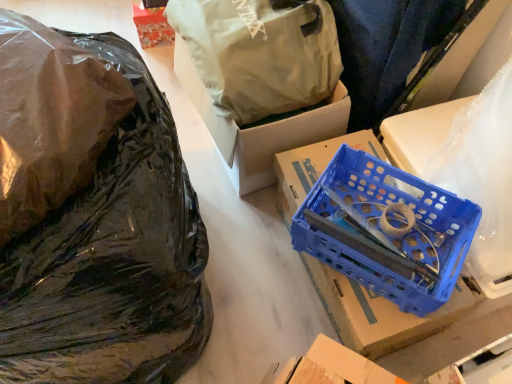
Question: From a real-world perspective, is transparent plastic bag at left, placed as the second plastic bag when sorted from top to bottom, positioned under matte white plastic bag at upper center, which ranks as the 1th plastic bag in top-to-bottom order, based on gravity?

Choices:
 (A) no
 (B) yes

Answer: (A)

Question: Does transparent plastic bag at left, which appears as the second plastic bag when ordered from the bottom, have a lesser width compared to matte white plastic bag at upper center, which ranks as the 1th plastic bag in top-to-bottom order?

Choices:
 (A) no
 (B) yes

Answer: (A)

Question: Is transparent plastic bag at left, placed as the second plastic bag when sorted from top to bottom, to the right of matte white plastic bag at upper center, which is the 3th plastic bag in bottom-to-top order, from the viewer's perspective?

Choices:
 (A) yes
 (B) no

Answer: (B)

Question: From a real-world perspective, is transparent plastic bag at left, placed as the second plastic bag when sorted from top to bottom, on matte white plastic bag at upper center, which is the 3th plastic bag in bottom-to-top order?

Choices:
 (A) yes
 (B) no

Answer: (A)

Question: Considering the relative positions of transparent plastic bag at left, placed as the second plastic bag when sorted from top to bottom, and matte white plastic bag at upper center, which is the 3th plastic bag in bottom-to-top order, in the image provided, is transparent plastic bag at left, placed as the second plastic bag when sorted from top to bottom, in front of matte white plastic bag at upper center, which is the 3th plastic bag in bottom-to-top order,?

Choices:
 (A) yes
 (B) no

Answer: (A)

Question: Can you confirm if transparent plastic bag at left, placed as the second plastic bag when sorted from top to bottom, is smaller than matte white plastic bag at upper center, which is the 3th plastic bag in bottom-to-top order?

Choices:
 (A) yes
 (B) no

Answer: (A)

Question: Is matte white plastic bag at upper center, which is the 3th plastic bag in bottom-to-top order, a part of black plastic bag at left, which ranks as the 3th plastic bag in top-to-bottom order?

Choices:
 (A) yes
 (B) no

Answer: (B)

Question: From the image's perspective, is black plastic bag at left, which ranks as the 3th plastic bag in top-to-bottom order, under matte white plastic bag at upper center, which is the 3th plastic bag in bottom-to-top order?

Choices:
 (A) yes
 (B) no

Answer: (A)

Question: Can we say black plastic bag at left, which ranks as the 3th plastic bag in top-to-bottom order, lies outside matte white plastic bag at upper center, which is the 3th plastic bag in bottom-to-top order?

Choices:
 (A) yes
 (B) no

Answer: (A)

Question: Is the depth of black plastic bag at left, which ranks as the 3th plastic bag in top-to-bottom order, less than that of matte white plastic bag at upper center, which is the 3th plastic bag in bottom-to-top order?

Choices:
 (A) no
 (B) yes

Answer: (B)

Question: Is black plastic bag at left, positioned as the 1th plastic bag in bottom-to-top order, far away from matte white plastic bag at upper center, which is the 3th plastic bag in bottom-to-top order?

Choices:
 (A) no
 (B) yes

Answer: (A)

Question: Can you confirm if black plastic bag at left, positioned as the 1th plastic bag in bottom-to-top order, is bigger than matte white plastic bag at upper center, which is the 3th plastic bag in bottom-to-top order?

Choices:
 (A) yes
 (B) no

Answer: (A)

Question: Is transparent plastic bag at left, which appears as the second plastic bag when ordered from the bottom, oriented away from white cardboard box at upper center, the 2th box viewed from the front?

Choices:
 (A) yes
 (B) no

Answer: (B)